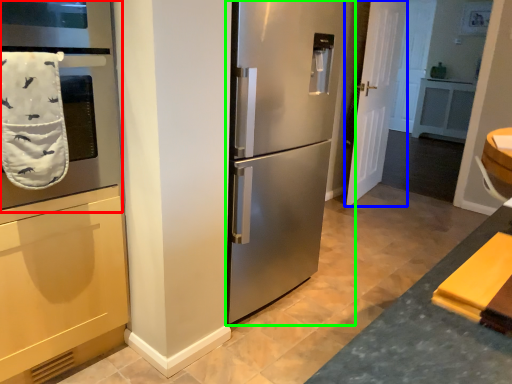
Question: Which object is the farthest from oven (highlighted by a red box)? Choose among these: door (highlighted by a blue box) or refrigerator (highlighted by a green box).

Choices:
 (A) door
 (B) refrigerator

Answer: (A)